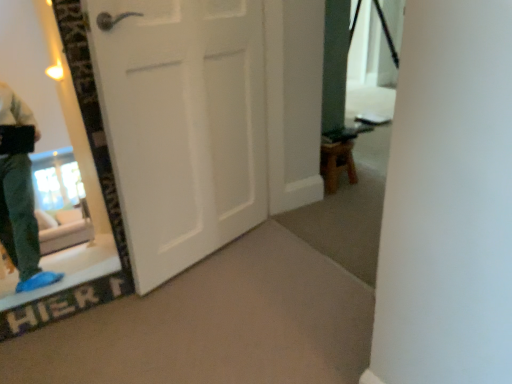
Identify the location of vacant space in white matte door at center (from a real-world perspective). (201, 259).